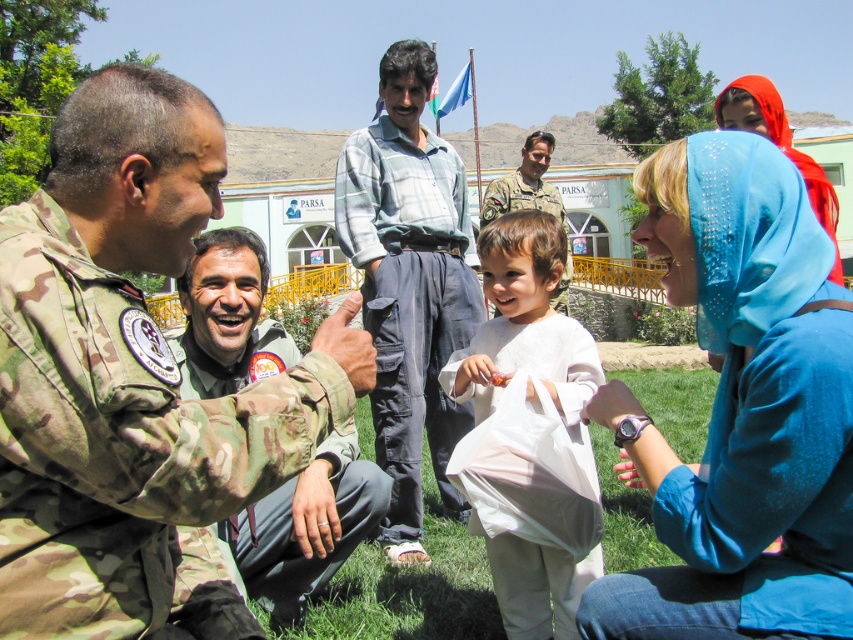
You are a photographer trying to capture a photo of the scene. The camera you are using has a limited depth of field that can only focus on one object at a time. You want to ensure that both the camo uniform at left and the light blue plaid shirt at center are in focus. Based on their positions, which object should you focus on to maximize the chances of both being sharp?

The camo uniform at left is below the light blue plaid shirt at center, so focusing on the light blue plaid shirt at center would place it closer to the camera, increasing the likelihood that both objects remain in focus due to the depth of field extending backward to include the camo uniform at left.

You are a photographer trying to capture a clear shot of the camo uniform at left and the blue fabric headscarf at upper right. Which object will appear narrower in your photo?

The camo uniform at left is thinner than the blue fabric headscarf at upper right, so it will appear narrower in the photo.